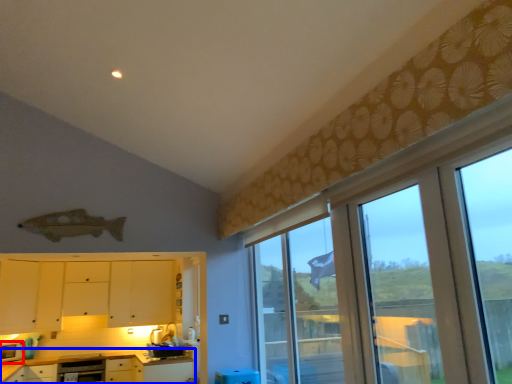
Question: Among these objects, which one is nearest to the camera, appliance (highlighted by a red box) or cabinetry (highlighted by a blue box)?

Choices:
 (A) appliance
 (B) cabinetry

Answer: (B)